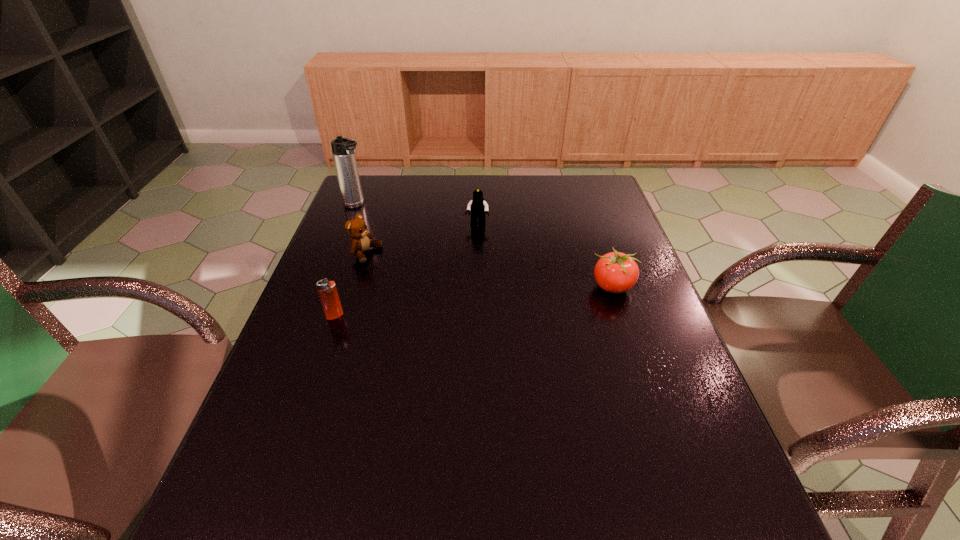
At what (x,y) coordinates should I click in order to perform the action: click on vacant area situated 0.060m on the front-facing side of the third nearest object. Please return your answer as a coordinate pair (x, y). This screenshot has height=540, width=960. Looking at the image, I should click on (396, 264).

Identify the location of free space located on the front-facing side of the third nearest object. (489, 294).

This screenshot has height=540, width=960. I want to click on vacant space located on the front-facing side of the third nearest object, so click(458, 285).

Find the location of `free space located on the front-facing side of the Lego`. free space located on the front-facing side of the Lego is located at coordinates (461, 302).

Locate an element on the screen. free point located on the front-facing side of the Lego is located at coordinates (464, 289).

Where is `vacant space located on the front-facing side of the Lego`? The height and width of the screenshot is (540, 960). vacant space located on the front-facing side of the Lego is located at coordinates (459, 310).

At what (x,y) coordinates should I click in order to perform the action: click on blank space located on the handle side of the thermos bottle. Please return your answer as a coordinate pair (x, y). The width and height of the screenshot is (960, 540). Looking at the image, I should click on (374, 216).

This screenshot has height=540, width=960. I want to click on vacant point located on the handle side of the thermos bottle, so click(x=374, y=216).

This screenshot has height=540, width=960. I want to click on vacant space located on the handle side of the thermos bottle, so click(x=444, y=256).

What are the coordinates of `object positioned at the far edge` in the screenshot? It's located at (343, 149).